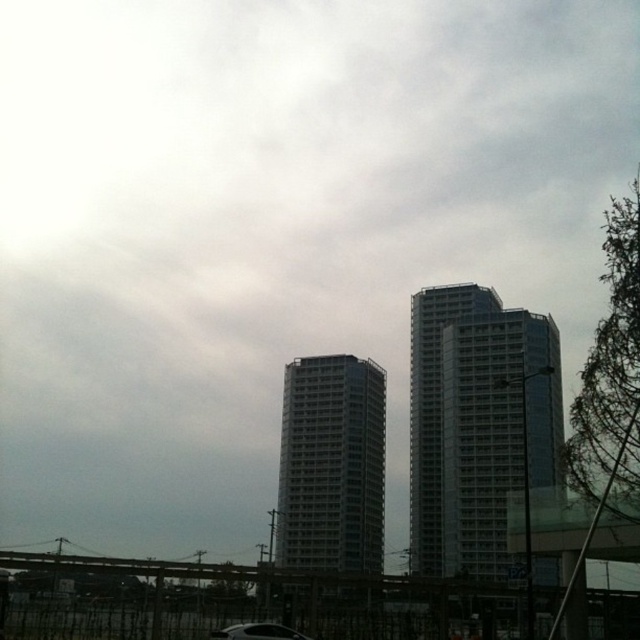
Question: Which point appears farthest from the camera in this image?

Choices:
 (A) (332, 554)
 (B) (292, 630)
 (C) (428, 340)

Answer: (C)

Question: Among these objects, which one is nearest to the camera?

Choices:
 (A) black glossy car at lower center
 (B) gray concrete building at center
 (C) glassy silver building at right

Answer: (C)

Question: Can you confirm if gray concrete building at center is bigger than black glossy car at lower center?

Choices:
 (A) no
 (B) yes

Answer: (B)

Question: Which is nearer to the glassy silver building at right?

Choices:
 (A) gray concrete building at center
 (B) black glossy car at lower center

Answer: (A)

Question: Is gray concrete building at center below black glossy car at lower center?

Choices:
 (A) yes
 (B) no

Answer: (A)

Question: Is gray concrete building at center wider than black glossy car at lower center?

Choices:
 (A) no
 (B) yes

Answer: (B)